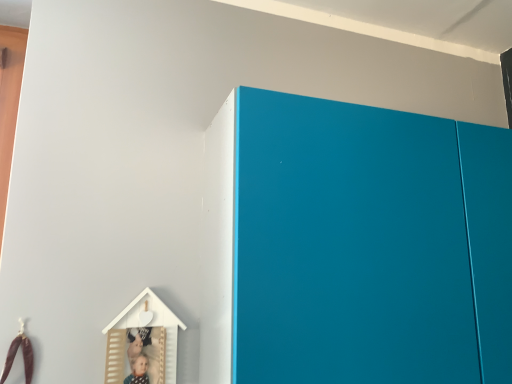
Question: From the image's perspective, is brown leather toy at lower left, the 1th toy when ordered from left to right, located above or below matte blue cabinet at upper right?

Choices:
 (A) above
 (B) below

Answer: (B)

Question: Is point (24, 362) closer or farther from the camera than point (240, 231)?

Choices:
 (A) closer
 (B) farther

Answer: (B)

Question: Which object is positioned closest to the white matte wooden house at lower left, which is the 1th toy from right to left?

Choices:
 (A) brown leather toy at lower left, the 2th toy from the right
 (B) matte blue cabinet at upper right

Answer: (A)

Question: Which of these objects is positioned farthest from the white matte wooden house at lower left, which is the 1th toy from right to left?

Choices:
 (A) brown leather toy at lower left, the 2th toy from the right
 (B) matte blue cabinet at upper right

Answer: (B)